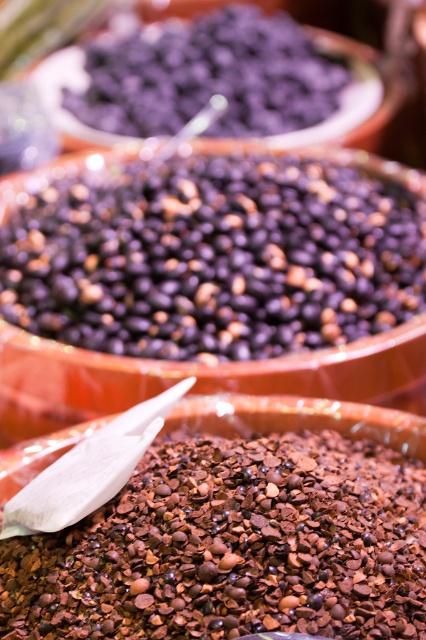
You are a customer at a spice shop looking at two points in the image. One is labeled as point (135,336) and the other as point (48,550). Which point is closer to you?

Point (135,336) is further to the camera than point (48,550), so the point closer to you is point (48,550).

Looking at this image, you are a customer at a spice shop and want to take a closer look at the dark matte beans at center and the dark purple matte beans at upper center. Which of these two items would you need to move forward to examine more closely?

The dark purple matte beans at upper center are behind the dark matte beans at center, so you would need to move the dark matte beans at center forward to examine the dark purple matte beans at upper center more closely.